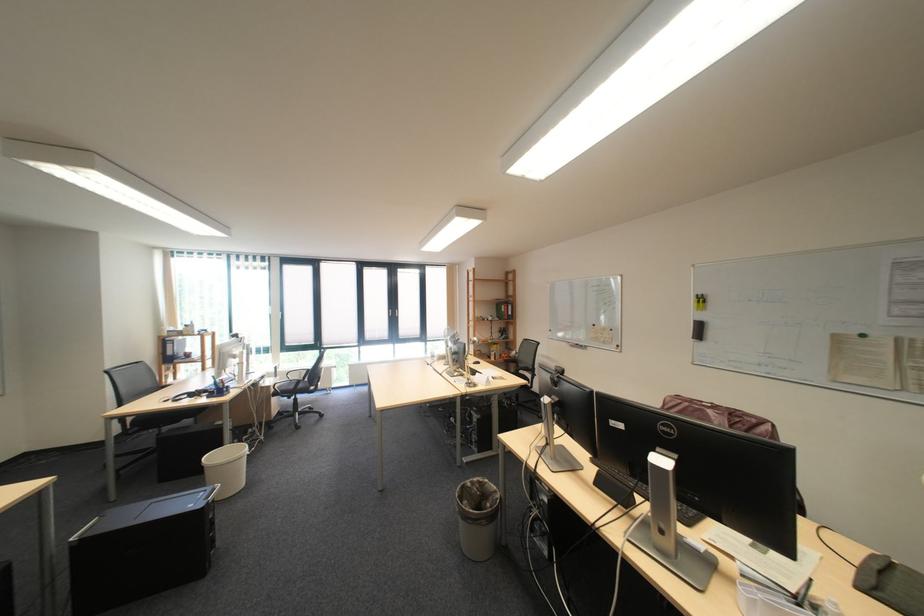
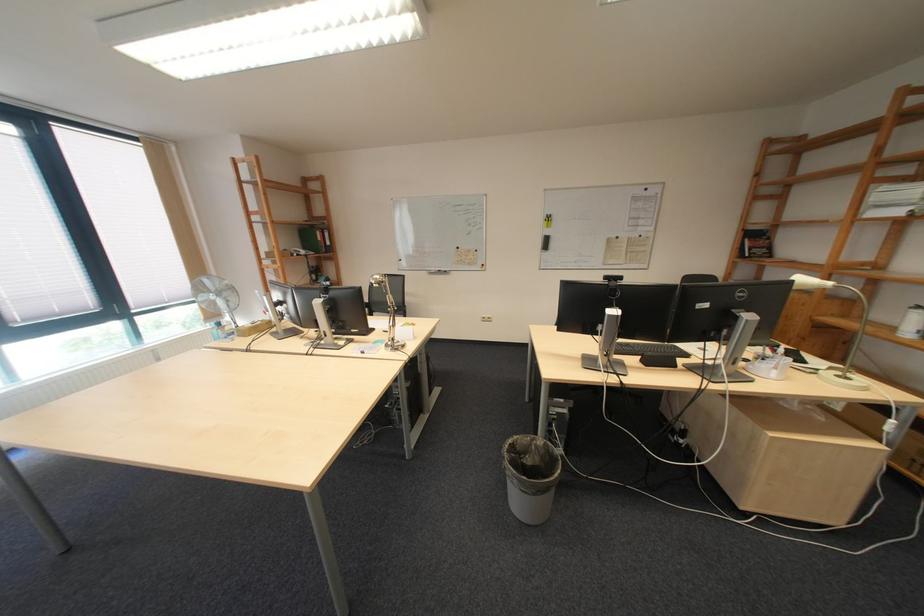
In the second image, find the point that corresponds to the point at 508,307 in the first image.

(310, 233)